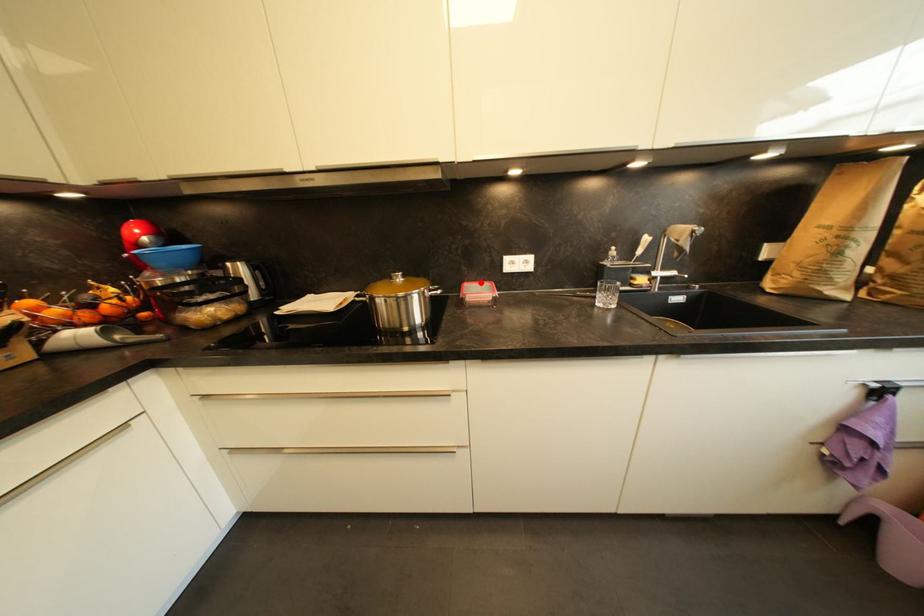
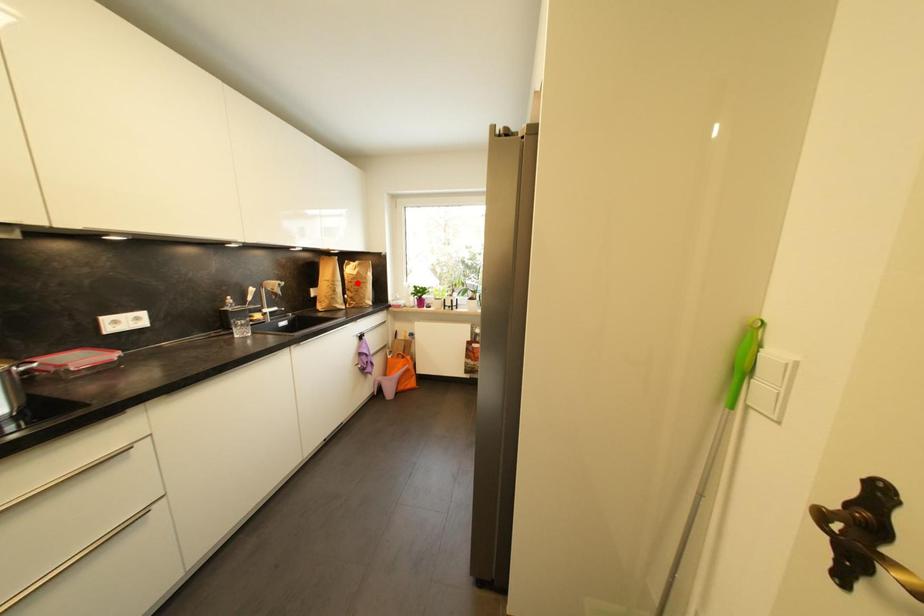
I am providing you with two images of the same scene from different viewpoints. A red point is marked on the first image and another point is marked on the second image. Is the red point in image1 aligned with the point shown in image2?

No